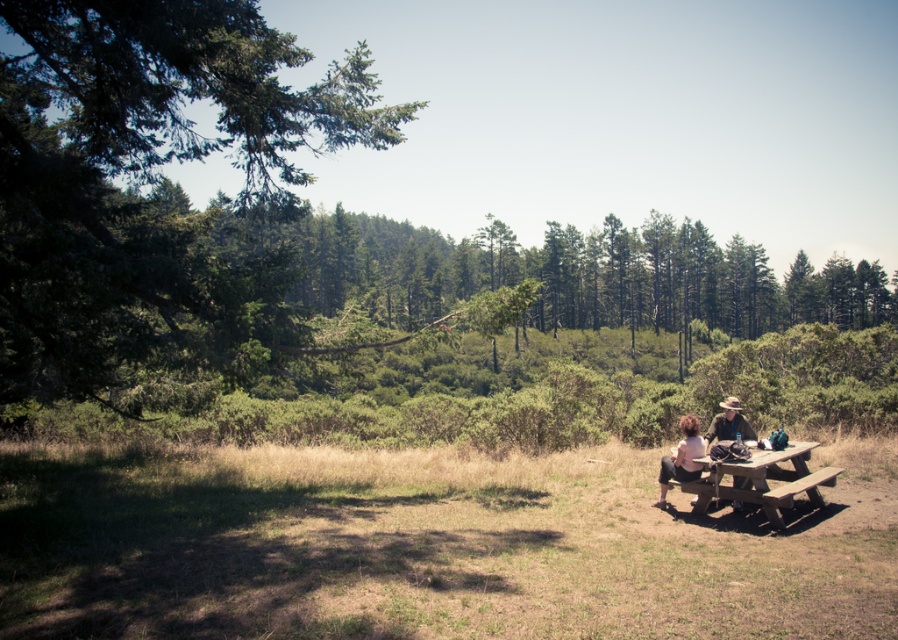
Is wooden picnic table at lower right above light brown hair at lower right?

No.

Can you confirm if wooden picnic table at lower right is thinner than light brown hair at lower right?

No, wooden picnic table at lower right is not thinner than light brown hair at lower right.

Where is `wooden picnic table at lower right`? wooden picnic table at lower right is located at coordinates (762, 481).

Locate an element on the screen. The width and height of the screenshot is (898, 640). wooden picnic table at lower right is located at coordinates (762, 481).

Which is behind, point (691, 451) or point (722, 406)?

The point (722, 406) is behind.

Locate an element on the screen. This screenshot has height=640, width=898. light brown hair at lower right is located at coordinates (681, 458).

Who is more distant from viewer, (x=675, y=456) or (x=728, y=401)?

Point (x=728, y=401)

You are a GUI agent. You are given a task and a screenshot of the screen. Output one action in this format:
    pyautogui.click(x=<x>, y=<y>)
    Task: Click on the light brown hair at lower right
    
    Given the screenshot: What is the action you would take?
    pyautogui.click(x=681, y=458)

From the picture: Is wooden picnic table at lower right below brown leather hat at right?

Yes, wooden picnic table at lower right is below brown leather hat at right.

Does wooden picnic table at lower right have a greater width compared to brown leather hat at right?

Indeed, wooden picnic table at lower right has a greater width compared to brown leather hat at right.

What do you see at coordinates (762, 481) in the screenshot? Image resolution: width=898 pixels, height=640 pixels. I see `wooden picnic table at lower right` at bounding box center [762, 481].

At what (x,y) coordinates should I click in order to perform the action: click on wooden picnic table at lower right. Please return your answer as a coordinate pair (x, y). This screenshot has height=640, width=898. Looking at the image, I should click on (762, 481).